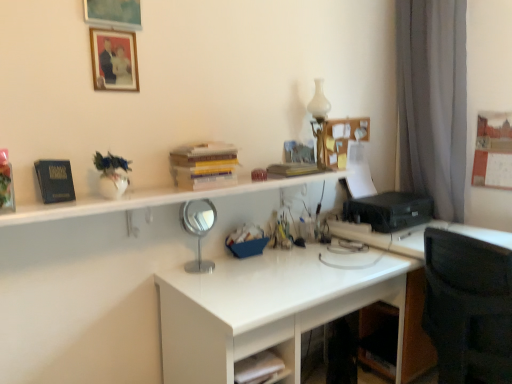
What are the coordinates of `blank space to the left of hardcover book at upper center, which appears as the 1th book when viewed from the right` in the screenshot? It's located at (261, 177).